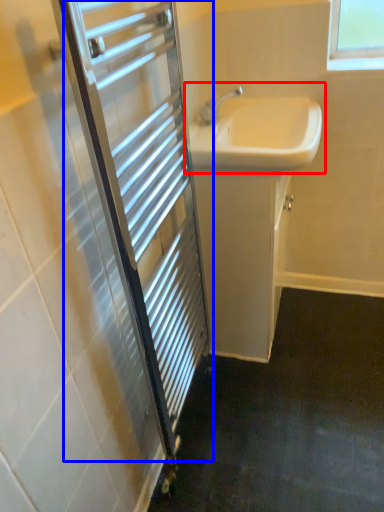
Question: Which point is further to the camera, sink (highlighted by a red box) or screen door (highlighted by a blue box)?

Choices:
 (A) sink
 (B) screen door

Answer: (A)